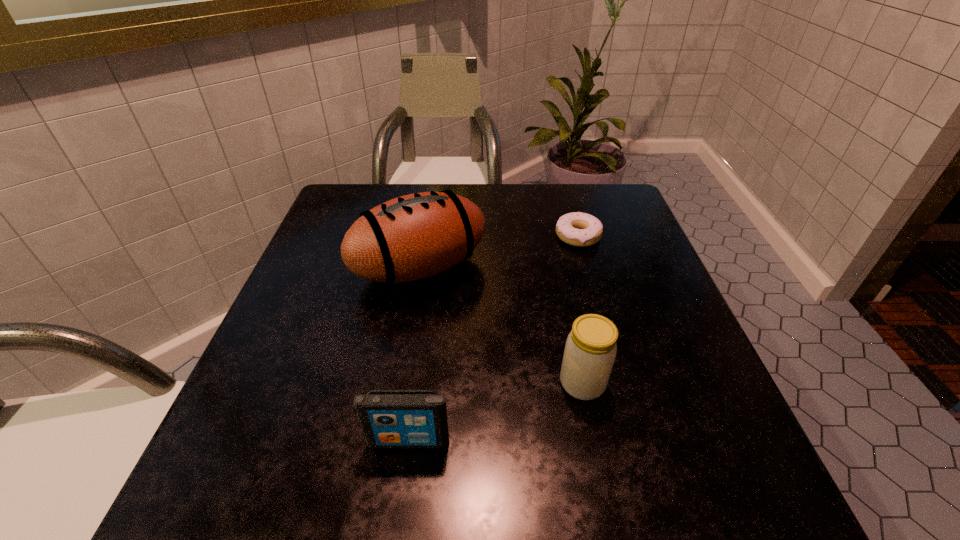
At what (x,y) coordinates should I click in order to perform the action: click on object that is the closest to the football (American). Please return your answer as a coordinate pair (x, y). This screenshot has width=960, height=540. Looking at the image, I should click on (579, 229).

The image size is (960, 540). I want to click on the closest object to the shortest object, so click(416, 236).

Identify the location of vacant space that satisfies the following two spatial constraints: 1. on the back side of the football (American); 2. on the right side of the shortest object. (425, 236).